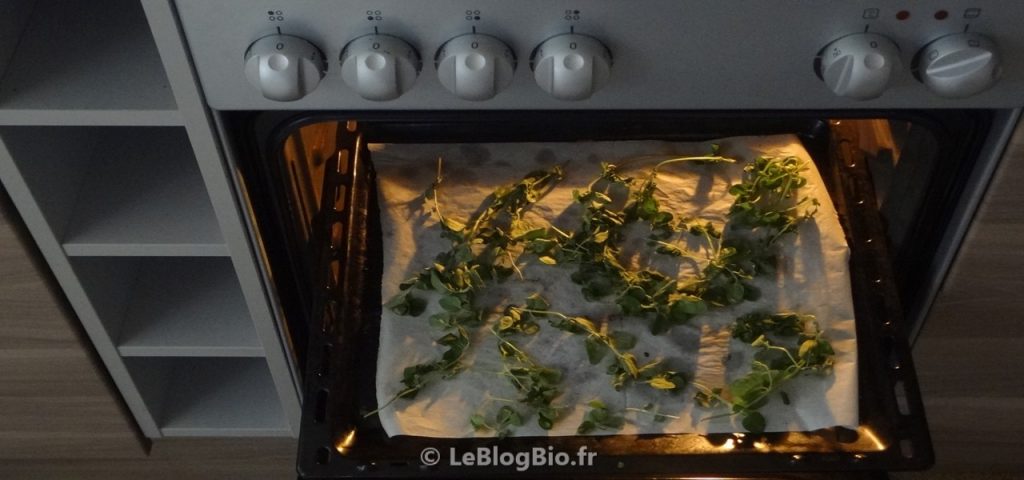
This screenshot has width=1024, height=480. I want to click on rack, so click(x=333, y=259).